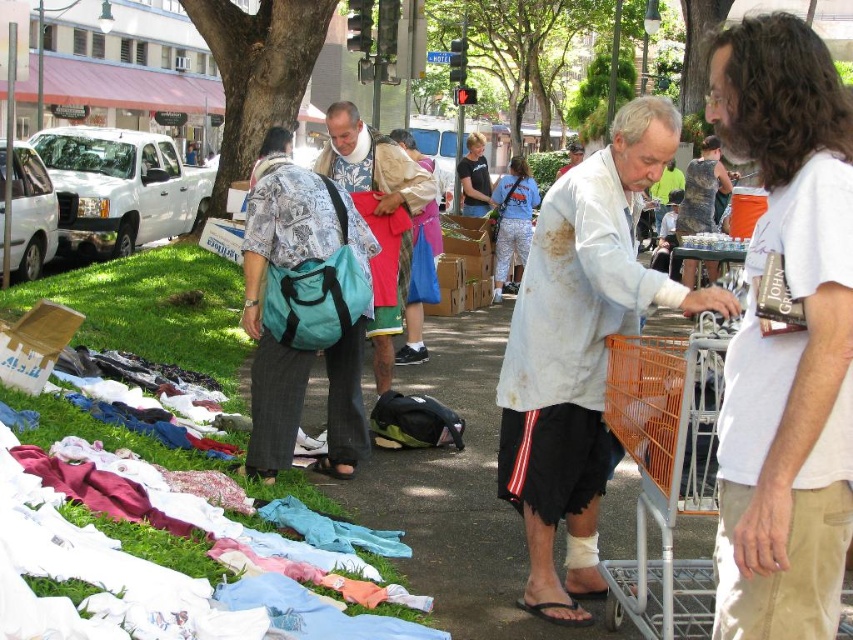
Is point (527, 218) positioned before point (720, 177)?

That is False.

Can you confirm if blue cotton shirt at center is taller than camouflage fabric dress at center?

Indeed, blue cotton shirt at center has a greater height compared to camouflage fabric dress at center.

Is point (526, 202) positioned after point (708, 262)?

That is True.

The width and height of the screenshot is (853, 640). In order to click on blue cotton shirt at center in this screenshot , I will do `click(512, 220)`.

Is matte khaki shirt at center to the right of matte black t-shirt at center from the viewer's perspective?

Incorrect, matte khaki shirt at center is not on the right side of matte black t-shirt at center.

Does matte khaki shirt at center appear on the left side of matte black t-shirt at center?

Correct, you'll find matte khaki shirt at center to the left of matte black t-shirt at center.

Where is `matte khaki shirt at center`? matte khaki shirt at center is located at coordinates (372, 164).

Identify the location of matte khaki shirt at center. (372, 164).

Between matte blue backpack at center and matte white shirt at center, which one is positioned lower?

matte blue backpack at center

Which is more to the right, matte blue backpack at center or matte white shirt at center?

matte white shirt at center

Locate an element on the screen. The width and height of the screenshot is (853, 640). matte blue backpack at center is located at coordinates (421, 282).